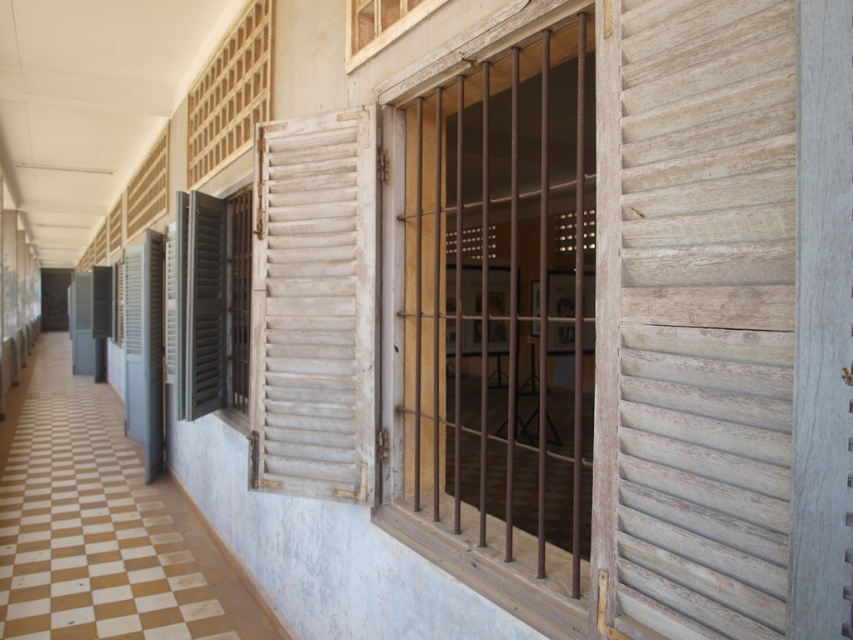
You are an interior designer assessing the corridor. You need to install a decorative panel between the brown wooden bars at center and the gray matte shutter at left. Which object requires a wider panel to fit properly?

The brown wooden bars at center require a wider panel because their width is larger than the gray matte shutter at left.

You are an interior designer planning to replace the shutters in the corridor. You have a standard shutter size of 1.2 meters. Which shutter between the white weathered wood shutter at center and the gray matte shutter at left would require a custom size larger than 1.2 meters?

The white weathered wood shutter at center is bigger than the gray matte shutter at left, so it would require a custom size larger than 1.2 meters.

You are standing in the corridor and notice the brown wooden bars at center and the weathered wood shutter at center. Which object is located to the right of the other?

The brown wooden bars at center is positioned on the right side of weathered wood shutter at center.